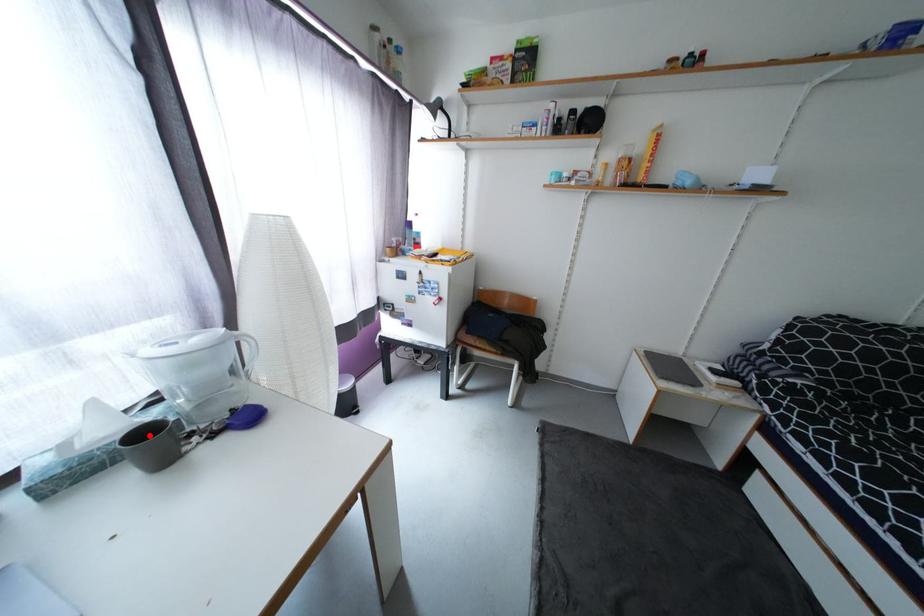
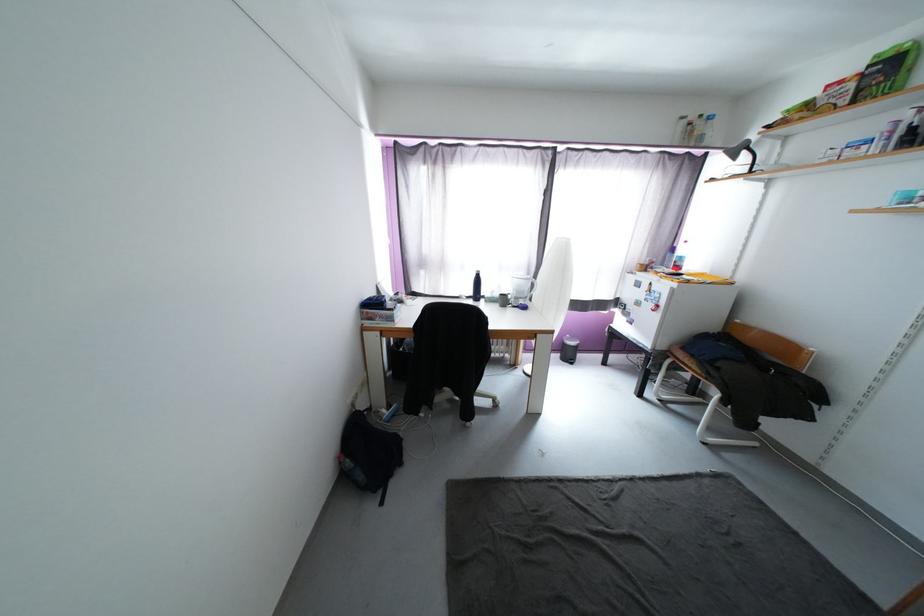
Question: I am providing you with two images of the same scene from different viewpoints. A red point is marked on the first image. Is the red point's position out of view in image 2?

Choices:
 (A) Yes
 (B) No

Answer: (A)